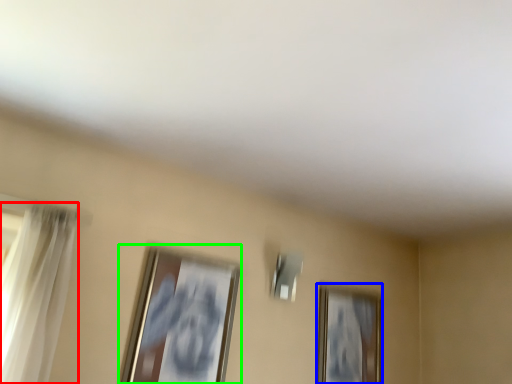
Question: Which object is the farthest from curtain (highlighted by a red box)? Choose among these: picture frame (highlighted by a blue box) or picture frame (highlighted by a green box).

Choices:
 (A) picture frame
 (B) picture frame

Answer: (A)